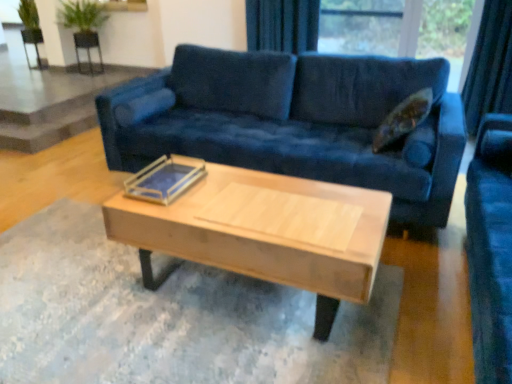
What are the coordinates of `metallic silver armchair at upper left, the second armchair in the right-to-left sequence` in the screenshot? It's located at (32, 44).

Where is `velvet blue couch at center`? Image resolution: width=512 pixels, height=384 pixels. velvet blue couch at center is located at coordinates (294, 121).

Considering the positions of objects velvet dark blue curtain at upper center and velvet blue couch at center in the image provided, who is more to the right, velvet dark blue curtain at upper center or velvet blue couch at center?

Positioned to the right is velvet dark blue curtain at upper center.

Is velvet dark blue curtain at upper center turned away from velvet blue couch at center?

That's not correct — velvet dark blue curtain at upper center is not looking away from velvet blue couch at center.

From a real-world perspective, which object stands above the other?

velvet dark blue curtain at upper center.

Consider the image. Can you confirm if velvet dark blue curtain at upper center is wider than velvet blue couch at center?

No.

Who is smaller, black mesh chair at upper left, the second armchair when ordered from left to right, or light wood/wooden coffee table at center?

With smaller size is black mesh chair at upper left, the second armchair when ordered from left to right.

Considering the positions of points (77, 57) and (197, 202), is point (77, 57) farther from camera compared to point (197, 202)?

Yes, it is.

Is black mesh chair at upper left, the second armchair when ordered from left to right, positioned far away from light wood/wooden coffee table at center?

Absolutely, black mesh chair at upper left, the second armchair when ordered from left to right, is distant from light wood/wooden coffee table at center.

Which is behind, black mesh chair at upper left, the second armchair when ordered from left to right, or light wood/wooden coffee table at center?

black mesh chair at upper left, the second armchair when ordered from left to right, is more distant.

Is black mesh chair at upper left, positioned as the first armchair in right-to-left order, to the left of velvet dark blue curtain at upper center from the viewer's perspective?

Yes.

Does black mesh chair at upper left, positioned as the first armchair in right-to-left order, have a lesser height compared to velvet dark blue curtain at upper center?

Correct, black mesh chair at upper left, positioned as the first armchair in right-to-left order, is not as tall as velvet dark blue curtain at upper center.

Can you confirm if black mesh chair at upper left, positioned as the first armchair in right-to-left order, is smaller than velvet dark blue curtain at upper center?

Correct, black mesh chair at upper left, positioned as the first armchair in right-to-left order, occupies less space than velvet dark blue curtain at upper center.

Is clear acrylic tray at center inside metallic silver armchair at upper left, marked as the first armchair in a left-to-right arrangement?

Actually, clear acrylic tray at center is outside metallic silver armchair at upper left, marked as the first armchair in a left-to-right arrangement.

Does metallic silver armchair at upper left, marked as the first armchair in a left-to-right arrangement, turn towards clear acrylic tray at center?

No, metallic silver armchair at upper left, marked as the first armchair in a left-to-right arrangement, is not turned towards clear acrylic tray at center.

Is metallic silver armchair at upper left, marked as the first armchair in a left-to-right arrangement, next to clear acrylic tray at center?

No, metallic silver armchair at upper left, marked as the first armchair in a left-to-right arrangement, is not in contact with clear acrylic tray at center.

Considering the sizes of metallic silver armchair at upper left, the second armchair in the right-to-left sequence, and clear acrylic tray at center in the image, is metallic silver armchair at upper left, the second armchair in the right-to-left sequence, wider or thinner than clear acrylic tray at center?

In the image, metallic silver armchair at upper left, the second armchair in the right-to-left sequence, appears to be more narrow than clear acrylic tray at center.

Looking at this image, from a real-world perspective, is velvet dark blue curtain at upper center physically located above or below black mesh chair at upper left, positioned as the first armchair in right-to-left order?

In terms of real-world spatial position, velvet dark blue curtain at upper center is above black mesh chair at upper left, positioned as the first armchair in right-to-left order.

Is velvet dark blue curtain at upper center far from black mesh chair at upper left, the second armchair when ordered from left to right?

Absolutely, velvet dark blue curtain at upper center is distant from black mesh chair at upper left, the second armchair when ordered from left to right.

Could you tell me if velvet dark blue curtain at upper center is facing black mesh chair at upper left, positioned as the first armchair in right-to-left order?

No, velvet dark blue curtain at upper center is not facing towards black mesh chair at upper left, positioned as the first armchair in right-to-left order.

Considering the positions of objects black mesh chair at upper left, the second armchair when ordered from left to right, and velvet blue couch at center in the image provided, who is more to the left, black mesh chair at upper left, the second armchair when ordered from left to right, or velvet blue couch at center?

black mesh chair at upper left, the second armchair when ordered from left to right, is more to the left.

From the image's perspective, would you say black mesh chair at upper left, positioned as the first armchair in right-to-left order, is shown under velvet blue couch at center?

Incorrect, from the image's perspective, black mesh chair at upper left, positioned as the first armchair in right-to-left order, is higher than velvet blue couch at center.

Does black mesh chair at upper left, the second armchair when ordered from left to right, come behind velvet blue couch at center?

Yes, it is.

Can you confirm if black mesh chair at upper left, the second armchair when ordered from left to right, is smaller than velvet blue couch at center?

Correct, black mesh chair at upper left, the second armchair when ordered from left to right, occupies less space than velvet blue couch at center.

Which object is positioned more to the right, clear acrylic tray at center or metallic silver armchair at upper left, the second armchair in the right-to-left sequence?

clear acrylic tray at center is more to the right.

From a real-world perspective, is clear acrylic tray at center positioned over metallic silver armchair at upper left, the second armchair in the right-to-left sequence, based on gravity?

Indeed, from a real-world perspective, clear acrylic tray at center stands above metallic silver armchair at upper left, the second armchair in the right-to-left sequence.

From the image's perspective, relative to metallic silver armchair at upper left, the second armchair in the right-to-left sequence, is clear acrylic tray at center above or below?

Clearly, from the image's perspective, clear acrylic tray at center is below metallic silver armchair at upper left, the second armchair in the right-to-left sequence.

Who is smaller, clear acrylic tray at center or metallic silver armchair at upper left, the second armchair in the right-to-left sequence?

Smaller between the two is clear acrylic tray at center.

This screenshot has height=384, width=512. Identify the location of studio couch located on the left of velvet dark blue curtain at upper center. (294, 121).

Locate an element on the screen. The width and height of the screenshot is (512, 384). the 1st armchair behind the light wood/wooden coffee table at center, starting your count from the anchor is located at coordinates (87, 48).

Estimate the real-world distances between objects in this image. Which object is closer to black mesh chair at upper left, positioned as the first armchair in right-to-left order, velvet blue couch at center or clear acrylic tray at center?

velvet blue couch at center is positioned closer to the anchor black mesh chair at upper left, positioned as the first armchair in right-to-left order.

From the picture: From the image, which object appears to be farther from metallic silver armchair at upper left, marked as the first armchair in a left-to-right arrangement, clear acrylic tray at center or light wood/wooden coffee table at center?

light wood/wooden coffee table at center lies further to metallic silver armchair at upper left, marked as the first armchair in a left-to-right arrangement, than the other object.

Estimate the real-world distances between objects in this image. Which object is further from light wood/wooden coffee table at center, black mesh chair at upper left, the second armchair when ordered from left to right, or metallic silver armchair at upper left, marked as the first armchair in a left-to-right arrangement?

black mesh chair at upper left, the second armchair when ordered from left to right.

When comparing their distances from black mesh chair at upper left, positioned as the first armchair in right-to-left order, does light wood/wooden coffee table at center or clear acrylic tray at center seem closer?

clear acrylic tray at center.

When comparing their distances from clear acrylic tray at center, does velvet blue couch at center or metallic silver armchair at upper left, marked as the first armchair in a left-to-right arrangement, seem further?

metallic silver armchair at upper left, marked as the first armchair in a left-to-right arrangement.

Looking at this image, which object lies nearer to the anchor point metallic silver armchair at upper left, the second armchair in the right-to-left sequence, black mesh chair at upper left, the second armchair when ordered from left to right, or light wood/wooden coffee table at center?

The object closer to metallic silver armchair at upper left, the second armchair in the right-to-left sequence, is black mesh chair at upper left, the second armchair when ordered from left to right.

Considering their positions, is black mesh chair at upper left, positioned as the first armchair in right-to-left order, positioned closer to clear acrylic tray at center than velvet blue couch at center?

velvet blue couch at center.

Which object lies nearer to the anchor point light wood/wooden coffee table at center, metallic silver armchair at upper left, marked as the first armchair in a left-to-right arrangement, or black mesh chair at upper left, positioned as the first armchair in right-to-left order?

metallic silver armchair at upper left, marked as the first armchair in a left-to-right arrangement, is positioned closer to the anchor light wood/wooden coffee table at center.

At what (x,y) coordinates should I click in order to perform the action: click on studio couch located between light wood/wooden coffee table at center and black mesh chair at upper left, positioned as the first armchair in right-to-left order, in the depth direction. Please return your answer as a coordinate pair (x, y). The width and height of the screenshot is (512, 384). Looking at the image, I should click on click(x=294, y=121).

Locate an element on the screen. curtain positioned between clear acrylic tray at center and metallic silver armchair at upper left, marked as the first armchair in a left-to-right arrangement, from near to far is located at coordinates point(282,25).

Where is `armchair located between clear acrylic tray at center and metallic silver armchair at upper left, the second armchair in the right-to-left sequence, in the depth direction`? This screenshot has width=512, height=384. armchair located between clear acrylic tray at center and metallic silver armchair at upper left, the second armchair in the right-to-left sequence, in the depth direction is located at coordinates (87, 48).

Where is `studio couch between metallic silver armchair at upper left, the second armchair in the right-to-left sequence, and velvet dark blue curtain at upper center, in the horizontal direction`? The height and width of the screenshot is (384, 512). studio couch between metallic silver armchair at upper left, the second armchair in the right-to-left sequence, and velvet dark blue curtain at upper center, in the horizontal direction is located at coordinates (294, 121).